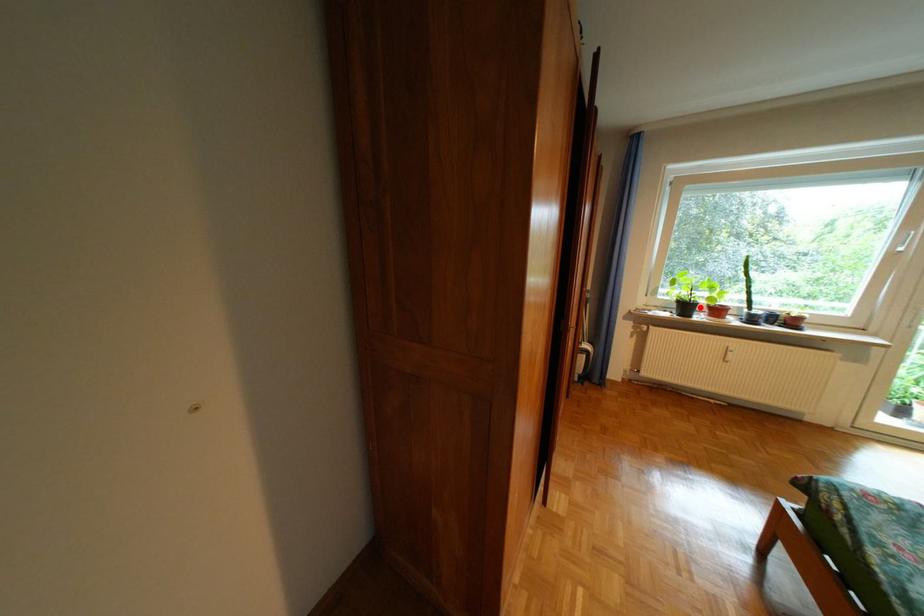
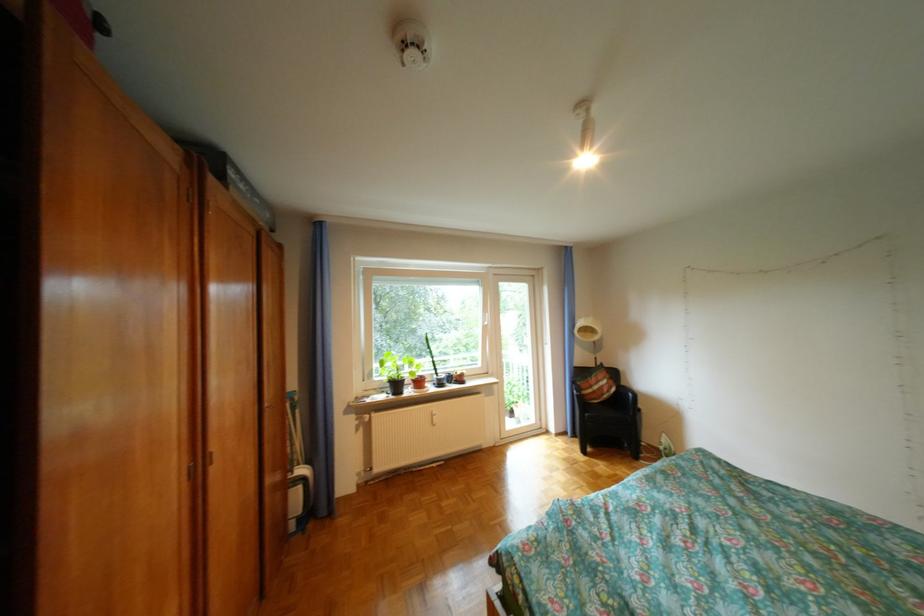
Find the pixel in the second image that matches the highlighted location in the first image.

(410, 386)